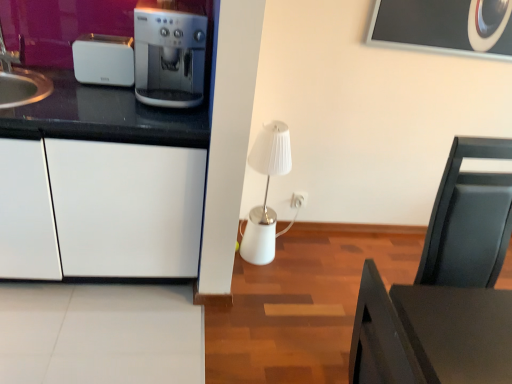
The width and height of the screenshot is (512, 384). Find the location of `unoccupied area in front of satin silver coffee machine at left`. unoccupied area in front of satin silver coffee machine at left is located at coordinates (156, 123).